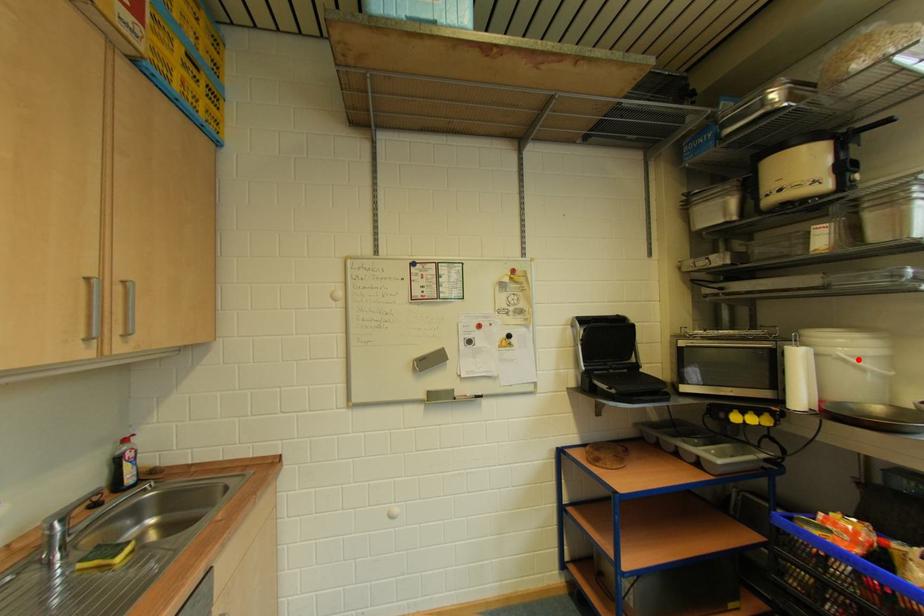
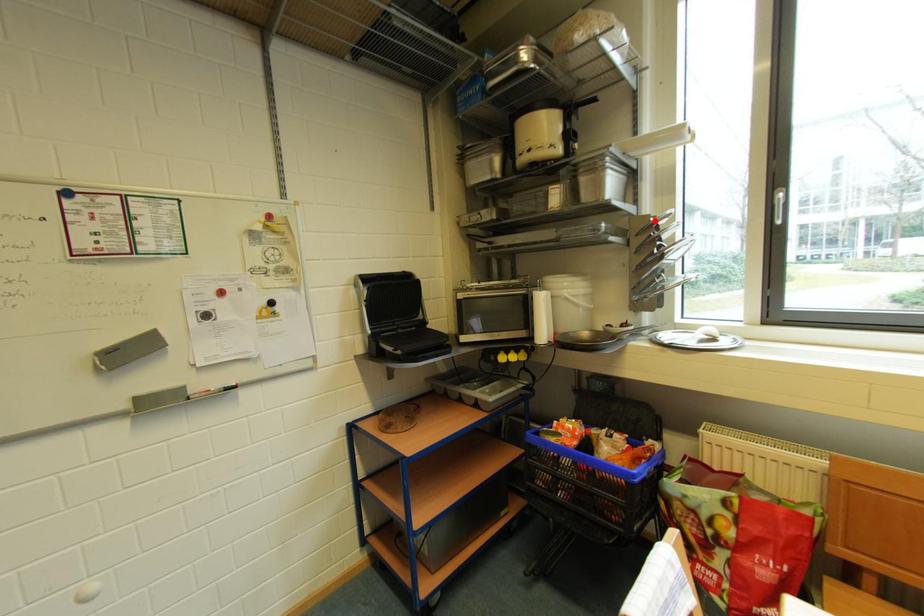
I am providing you with two images of the same scene from different viewpoints. A red point is marked on the first image and another point is marked on the second image. Do the highlighted points in image1 and image2 indicate the same real-world spot?

No